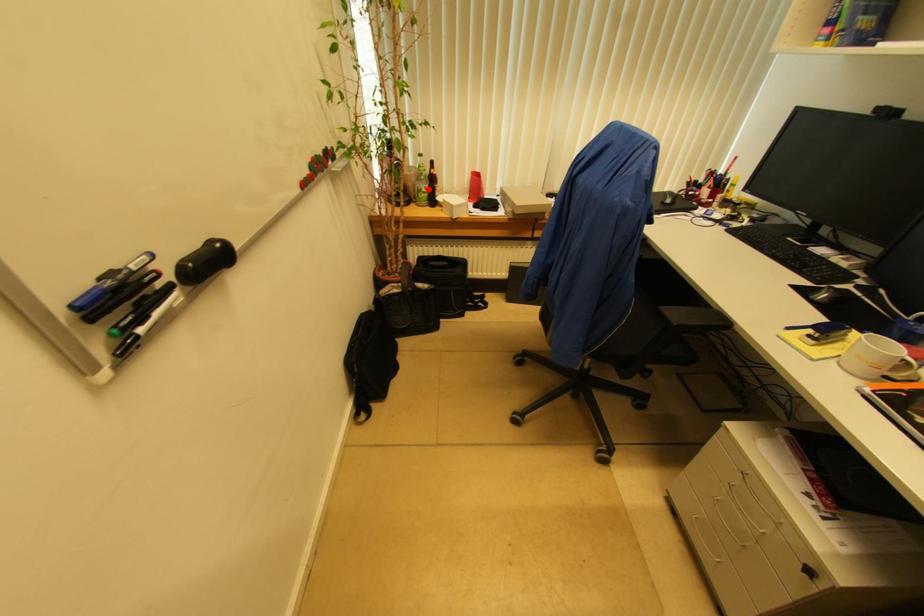
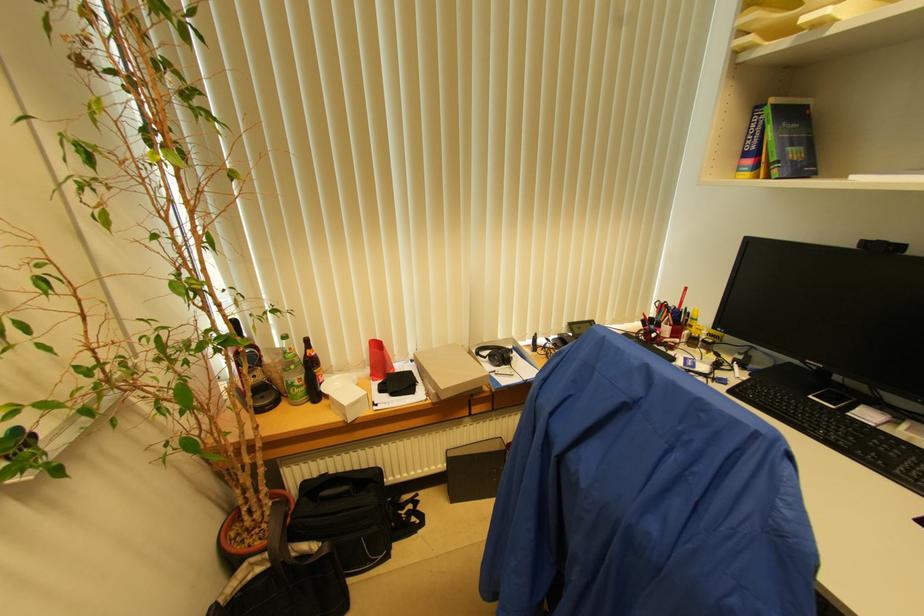
Question: I am providing you with two images of the same scene from different viewpoints. A red point is shown in image1. For the corresponding object point in image2, is it positioned nearer or farther from the camera?

Choices:
 (A) Nearer
 (B) Farther

Answer: (B)